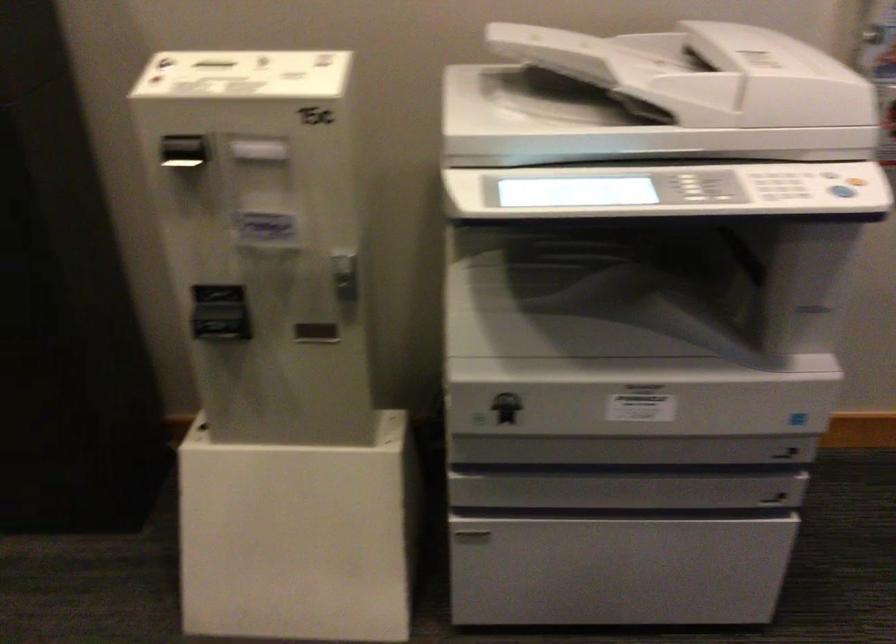
This screenshot has width=896, height=644. Describe the element at coordinates (185, 156) in the screenshot. I see `the card reader slot` at that location.